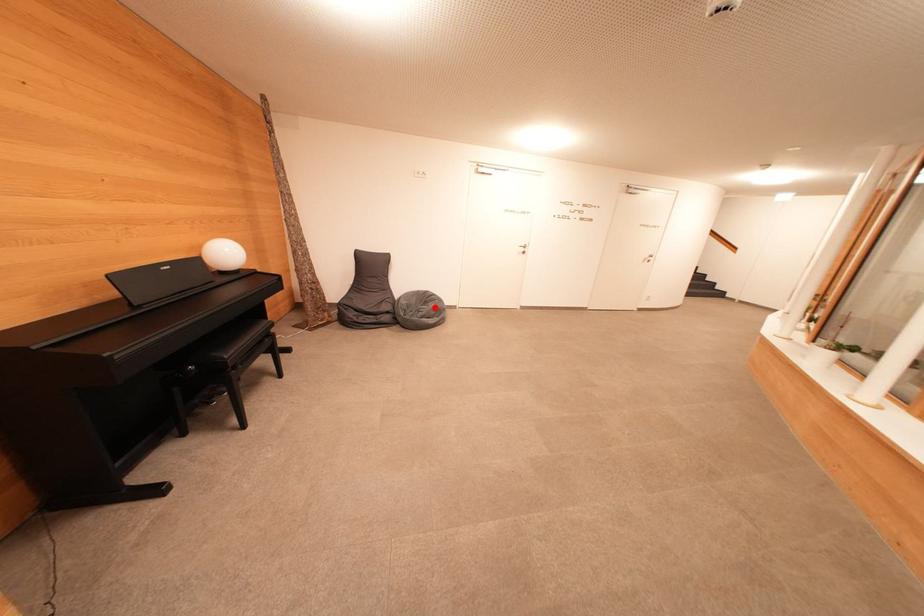
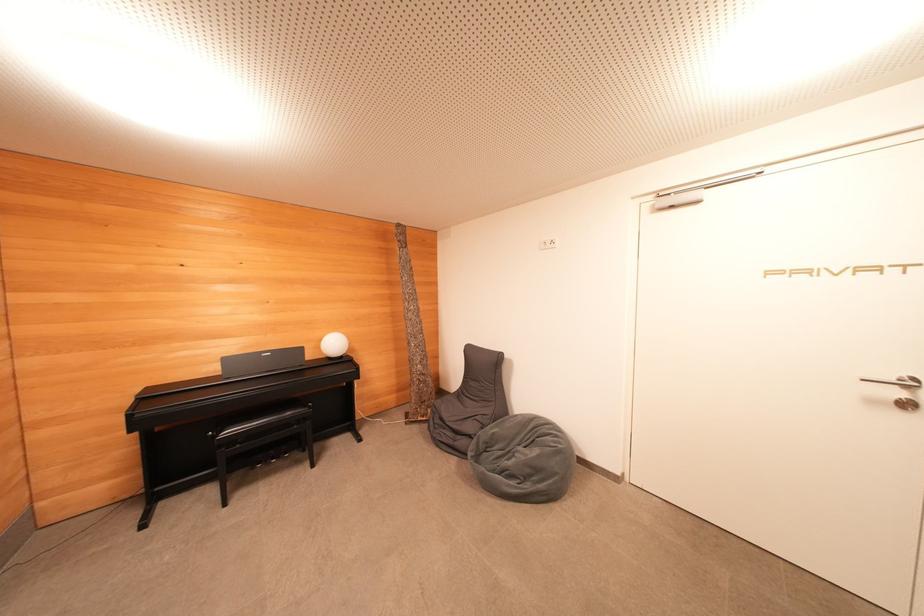
Find the pixel in the second image that matches the highlighted location in the first image.

(540, 455)